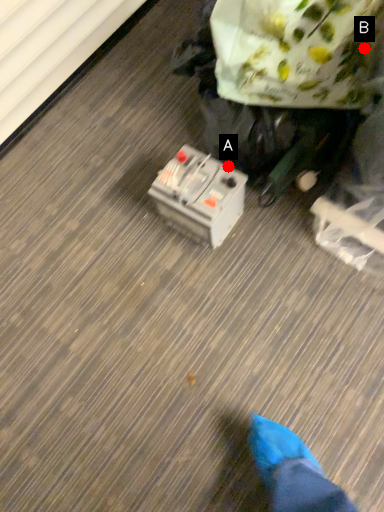
Question: Two points are circled on the image, labeled by A and B beside each circle. Which point is closer to the camera?

Choices:
 (A) A is closer
 (B) B is closer

Answer: (B)